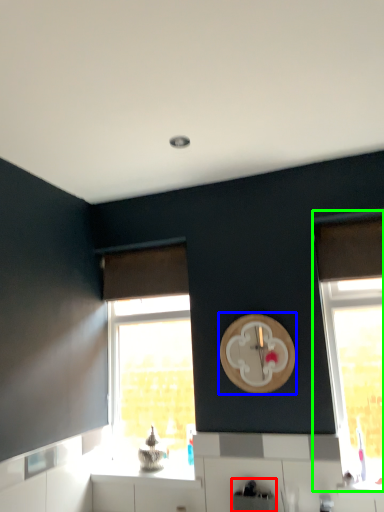
Question: Based on their relative distances, which object is farther from appliance (highlighted by a red box)? Choose from clock (highlighted by a blue box) and window (highlighted by a green box).

Choices:
 (A) clock
 (B) window

Answer: (A)